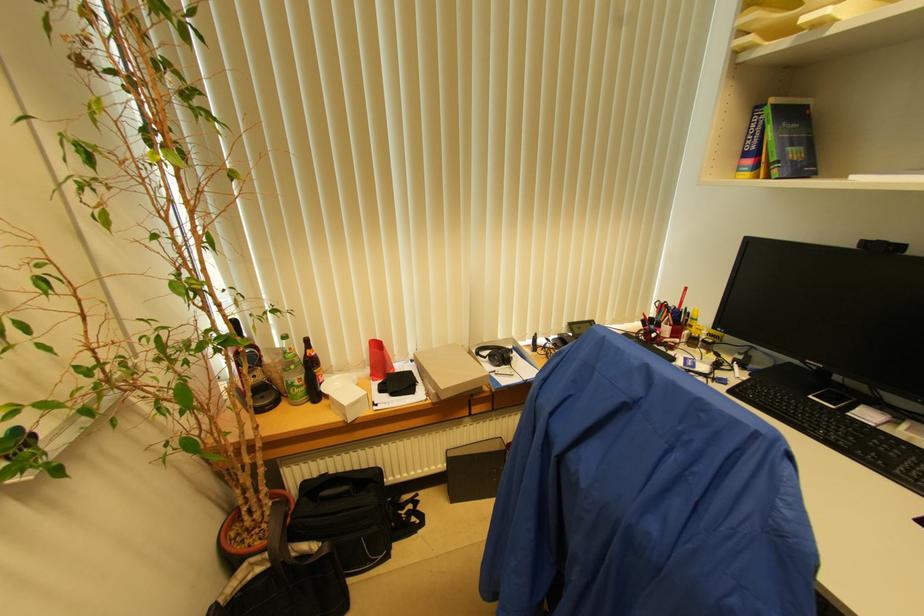
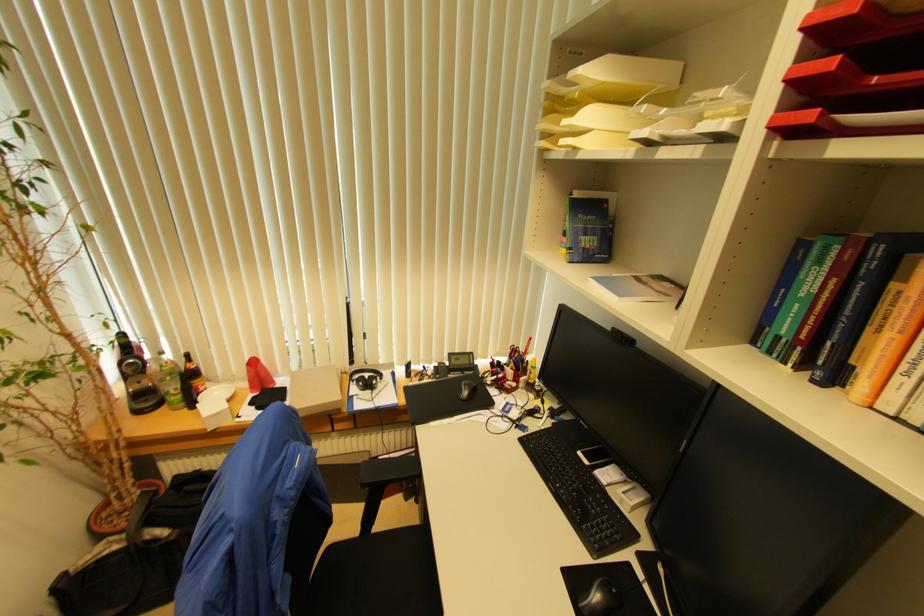
The point at (x=506, y=358) is marked in the first image. Where is the corresponding point in the second image?

(371, 384)